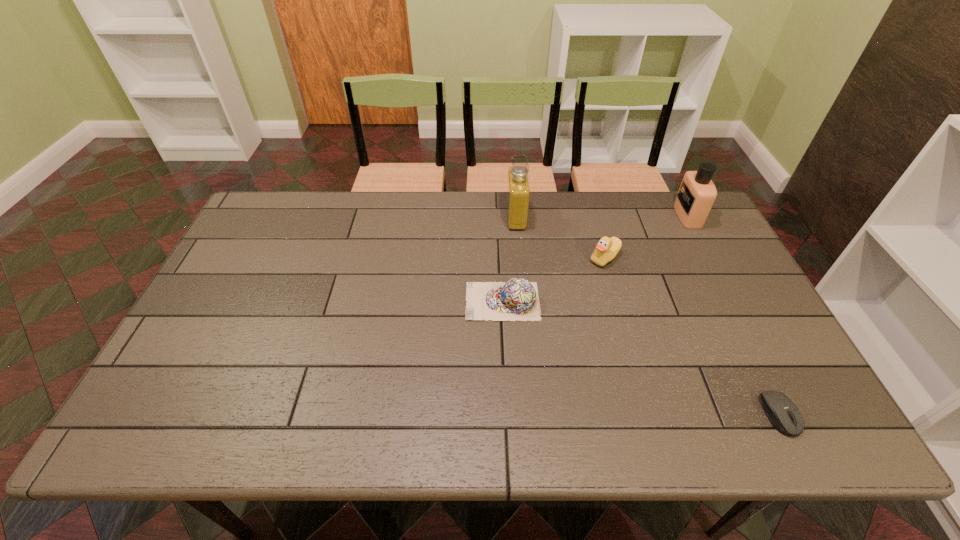
Find the location of a particular element. The width and height of the screenshot is (960, 540). vacant point located between the nearest object and the fourth tallest object is located at coordinates (641, 358).

At what (x,y) coordinates should I click in order to perform the action: click on empty space between the right perfume and the left perfume. Please return your answer as a coordinate pair (x, y). This screenshot has height=540, width=960. Looking at the image, I should click on (602, 217).

Locate an element on the screen. The width and height of the screenshot is (960, 540). vacant space in between the shortest object and the third farthest object is located at coordinates (692, 336).

Identify the location of free spot between the nearest object and the fourth farthest object. (641, 358).

Where is `free space between the third object from right to left and the left perfume`? This screenshot has width=960, height=540. free space between the third object from right to left and the left perfume is located at coordinates (561, 238).

Locate an element on the screen. This screenshot has height=540, width=960. vacant point located between the third object from left to right and the left perfume is located at coordinates (561, 238).

What are the coordinates of `vacant space in between the shortest object and the fourth farthest object` in the screenshot? It's located at (641, 358).

I want to click on empty space between the computer equipment and the right perfume, so click(733, 315).

I want to click on free space between the left perfume and the nearest object, so click(x=648, y=316).

Find the location of a particular element. Image resolution: width=960 pixels, height=540 pixels. object that stands as the second closest to the cap is located at coordinates (518, 188).